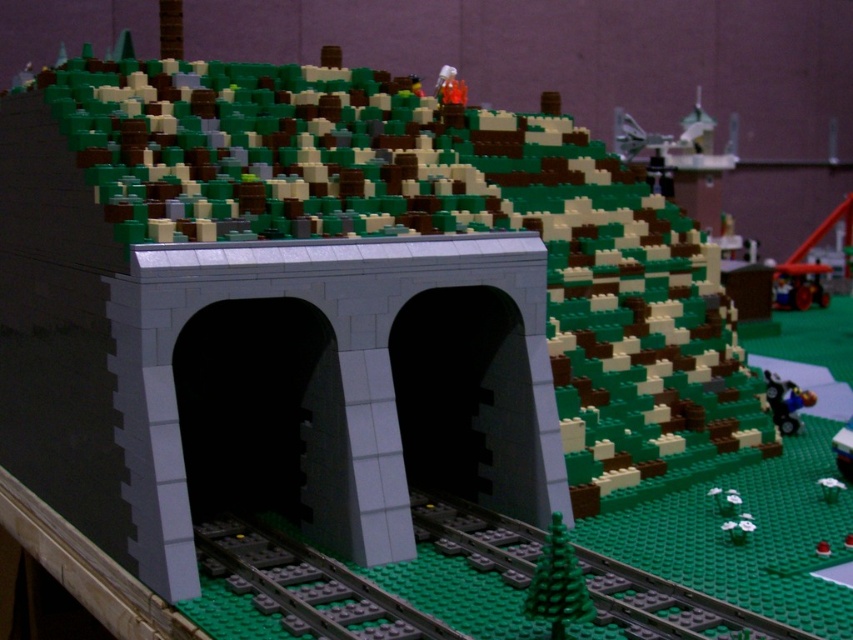
Question: Among these objects, which one is nearest to the camera?

Choices:
 (A) gray metallic train track at lower center
 (B) green plastic train track at lower center

Answer: (B)

Question: Which of the following is the closest to the observer?

Choices:
 (A) (305, 552)
 (B) (490, 572)

Answer: (B)

Question: Does green plastic train track at lower center have a lesser width compared to gray metallic train track at lower center?

Choices:
 (A) yes
 (B) no

Answer: (B)

Question: Can you confirm if green plastic train track at lower center is smaller than gray metallic train track at lower center?

Choices:
 (A) no
 (B) yes

Answer: (A)

Question: Does green plastic train track at lower center come in front of gray metallic train track at lower center?

Choices:
 (A) yes
 (B) no

Answer: (A)